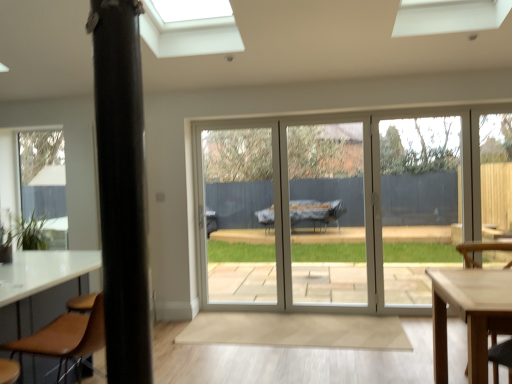
This screenshot has width=512, height=384. Describe the element at coordinates (66, 338) in the screenshot. I see `brown leather chair at lower left, the 2th chair when ordered from back to front` at that location.

Locate an element on the screen. This screenshot has height=384, width=512. black matte pole at left is located at coordinates (121, 188).

In order to click on pillar positioned vertically above the brown leather chair at lower left, which ranks as the first chair in left-to-right order (from a real-world perspective) in this screenshot , I will do `click(121, 188)`.

Is brown leather chair at lower left, which is the 2th chair from right to left, not inside black matte pole at left?

Yes, brown leather chair at lower left, which is the 2th chair from right to left, is outside of black matte pole at left.

Is point (51, 350) closer to viewer compared to point (108, 40)?

No, (51, 350) is behind (108, 40).

What's the angular difference between brown leather chair at lower left, which ranks as the first chair in left-to-right order, and black matte pole at left's facing directions?

83.8 degrees separate the facing orientations of brown leather chair at lower left, which ranks as the first chair in left-to-right order, and black matte pole at left.

Is brown leather chair at lower left, which ranks as the first chair in left-to-right order, thinner than green matte plant at lower left?

No, brown leather chair at lower left, which ranks as the first chair in left-to-right order, is not thinner than green matte plant at lower left.

Is green matte plant at lower left a part of brown leather chair at lower left, the 2th chair when ordered from back to front?

No, green matte plant at lower left is not inside brown leather chair at lower left, the 2th chair when ordered from back to front.

Is wooden chair at lower right, which appears as the 1th chair when viewed from the back, far from black matte pole at left?

That's right, there is a large distance between wooden chair at lower right, which appears as the 1th chair when viewed from the back, and black matte pole at left.

From the picture: From the image's perspective, would you say wooden chair at lower right, the 1th chair in the right-to-left sequence, is shown under black matte pole at left?

Correct, wooden chair at lower right, the 1th chair in the right-to-left sequence, appears lower than black matte pole at left in the image.

Consider the image. Which object is wider, wooden chair at lower right, the 1th chair in the right-to-left sequence, or black matte pole at left?

wooden chair at lower right, the 1th chair in the right-to-left sequence.

From a real-world perspective, is wooden chair at lower right, which appears as the 1th chair when viewed from the back, physically above black matte pole at left?

Incorrect, from a real-world perspective, wooden chair at lower right, which appears as the 1th chair when viewed from the back, is lower than black matte pole at left.

Is brown leather chair at lower left, which ranks as the 1th chair in front-to-back order, inside black matte pole at left?

No, black matte pole at left does not contain brown leather chair at lower left, which ranks as the 1th chair in front-to-back order.

Considering their positions, is black matte pole at left located in front of or behind brown leather chair at lower left, which is the 2th chair from right to left?

Clearly, black matte pole at left is in front of brown leather chair at lower left, which is the 2th chair from right to left.

In the scene shown: Is the surface of black matte pole at left in direct contact with brown leather chair at lower left, which ranks as the 1th chair in front-to-back order?

There is a gap between black matte pole at left and brown leather chair at lower left, which ranks as the 1th chair in front-to-back order.

Is wooden chair at lower right, which appears as the 1th chair when viewed from the back, thinner than green matte plant at lower left?

No, wooden chair at lower right, which appears as the 1th chair when viewed from the back, is not thinner than green matte plant at lower left.

Can you tell me how much wooden chair at lower right, the second chair viewed from the left, and green matte plant at lower left differ in facing direction?

0.254 degrees separate the facing orientations of wooden chair at lower right, the second chair viewed from the left, and green matte plant at lower left.

Is wooden chair at lower right, the second chair viewed from the left, turned away from green matte plant at lower left?

wooden chair at lower right, the second chair viewed from the left, is not turned away from green matte plant at lower left.

Is point (17, 245) closer or farther from the camera than point (104, 341)?

Point (17, 245) is positioned farther from the camera compared to point (104, 341).

Is green matte plant at lower left in contact with brown leather chair at lower left, which is the 2th chair from right to left?

No, green matte plant at lower left is not touching brown leather chair at lower left, which is the 2th chair from right to left.

Is green matte plant at lower left oriented towards brown leather chair at lower left, which is the 2th chair from right to left?

No, green matte plant at lower left is not turned towards brown leather chair at lower left, which is the 2th chair from right to left.

Which of these two, green matte plant at lower left or brown leather chair at lower left, which is the 2th chair from right to left, is bigger?

brown leather chair at lower left, which is the 2th chair from right to left.

From the image's perspective, is green matte plant at lower left located above or below black matte pole at left?

green matte plant at lower left is below black matte pole at left.

How many degrees apart are the facing directions of green matte plant at lower left and black matte pole at left?

The facing directions of green matte plant at lower left and black matte pole at left are 179 degrees apart.

Does green matte plant at lower left have a lesser height compared to black matte pole at left?

Correct, green matte plant at lower left is not as tall as black matte pole at left.

Find the location of a particular element. The width and height of the screenshot is (512, 384). the 1st chair behind the black matte pole at left, counting from the anchor's position is located at coordinates (66, 338).

At what (x,y) coordinates should I click in order to perform the action: click on plant that is above the brown leather chair at lower left, which ranks as the first chair in left-to-right order (from the image's perspective). Please return your answer as a coordinate pair (x, y). The width and height of the screenshot is (512, 384). Looking at the image, I should click on (28, 233).

Based on their spatial positions, is black matte pole at left or green matte plant at lower left further from wooden chair at lower right, the 1th chair in the right-to-left sequence?

green matte plant at lower left lies further to wooden chair at lower right, the 1th chair in the right-to-left sequence, than the other object.

Looking at the image, which one is located further to green matte plant at lower left, black matte pole at left or wooden chair at lower right, which is the 2th chair from front to back?

wooden chair at lower right, which is the 2th chair from front to back, is further to green matte plant at lower left.

Based on their spatial positions, is brown leather chair at lower left, which is the 2th chair from right to left, or green matte plant at lower left further from black matte pole at left?

green matte plant at lower left lies further to black matte pole at left than the other object.

Looking at the image, which one is located further to brown leather chair at lower left, which is the 2th chair from right to left, green matte plant at lower left or black matte pole at left?

green matte plant at lower left is positioned further to the anchor brown leather chair at lower left, which is the 2th chair from right to left.

When comparing their distances from wooden chair at lower right, the second chair viewed from the left, does green matte plant at lower left or brown leather chair at lower left, which is the 2th chair from right to left, seem closer?

brown leather chair at lower left, which is the 2th chair from right to left, is positioned closer to the anchor wooden chair at lower right, the second chair viewed from the left.

From the picture: Looking at the image, which one is located closer to wooden chair at lower right, the second chair viewed from the left, green matte plant at lower left or black matte pole at left?

black matte pole at left.

When comparing their distances from brown leather chair at lower left, which ranks as the first chair in left-to-right order, does green matte plant at lower left or wooden chair at lower right, which appears as the 1th chair when viewed from the back, seem further?

The object further to brown leather chair at lower left, which ranks as the first chair in left-to-right order, is wooden chair at lower right, which appears as the 1th chair when viewed from the back.

Looking at the image, which one is located closer to green matte plant at lower left, wooden chair at lower right, the second chair viewed from the left, or black matte pole at left?

The object closer to green matte plant at lower left is black matte pole at left.

What are the coordinates of `chair situated between green matte plant at lower left and wooden chair at lower right, which is the 2th chair from front to back, from left to right` in the screenshot? It's located at (66, 338).

Identify the location of pillar between green matte plant at lower left and wooden chair at lower right, which is the 2th chair from front to back, from left to right. This screenshot has width=512, height=384. (121, 188).

Image resolution: width=512 pixels, height=384 pixels. Identify the location of pillar between brown leather chair at lower left, which ranks as the first chair in left-to-right order, and wooden chair at lower right, which appears as the 1th chair when viewed from the back, from left to right. (121, 188).